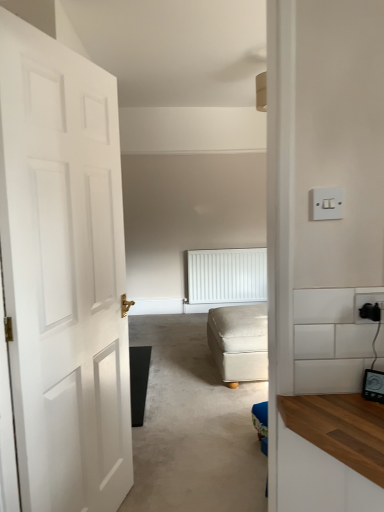
The image size is (384, 512). In order to click on white textured radiator at center in this screenshot , I will do `click(226, 276)`.

Describe the element at coordinates (239, 341) in the screenshot. The image size is (384, 512). I see `beige fabric ottoman at center` at that location.

Find the location of `white matte door at left`. white matte door at left is located at coordinates (193, 426).

I want to click on black plastic socket at right, so click(367, 307).

From a real-world perspective, which is physically above, white plastic light switch at upper right or black plastic socket at right?

From a 3D spatial view, white plastic light switch at upper right is above.

From the image's perspective, is white plastic light switch at upper right located beneath black plastic socket at right?

No, from the image's perspective, white plastic light switch at upper right is not below black plastic socket at right.

Between white matte door at left and beige fabric ottoman at center, which one is positioned behind?

Positioned behind is beige fabric ottoman at center.

The width and height of the screenshot is (384, 512). Find the location of `door that appears on the left of beige fabric ottoman at center`. door that appears on the left of beige fabric ottoman at center is located at coordinates (64, 273).

Does white matte door at left have a lesser height compared to beige fabric ottoman at center?

In fact, white matte door at left may be taller than beige fabric ottoman at center.

Measure the distance between white matte door at left and beige fabric ottoman at center.

They are 5.60 feet apart.

Based on their sizes in the image, would you say white matte door at left is bigger or smaller than white textured radiator at center?

white matte door at left is bigger than white textured radiator at center.

Who is more distant, white matte door at left or white textured radiator at center?

white textured radiator at center is more distant.

Is white matte door at left not near white textured radiator at center?

Yes, white matte door at left and white textured radiator at center are quite far apart.

Considering the relative sizes of white matte door at left and white textured radiator at center in the image provided, is white matte door at left taller than white textured radiator at center?

No, white matte door at left is not taller than white textured radiator at center.

Consider the image. Which is more to the left, white matte door at left or white plastic light switch at upper right?

white matte door at left.

From the image's perspective, is white matte door at left above or below white plastic light switch at upper right?

Based on their image positions, white matte door at left is located beneath white plastic light switch at upper right.

Does white matte door at left have a lesser width compared to white plastic light switch at upper right?

Incorrect, the width of white matte door at left is not less than that of white plastic light switch at upper right.

This screenshot has height=512, width=384. In order to click on plain on the left of beige fabric ottoman at center in this screenshot , I will do `click(193, 426)`.

Based on the photo, are beige fabric ottoman at center and white matte door at left making contact?

There is a gap between beige fabric ottoman at center and white matte door at left.

Is beige fabric ottoman at center in front of or behind white matte door at left in the image?

beige fabric ottoman at center is positioned farther from the viewer than white matte door at left.

Looking at this image, considering the relative positions of beige fabric ottoman at center and white matte door at left in the image provided, is beige fabric ottoman at center to the left of white matte door at left from the viewer's perspective?

Incorrect, beige fabric ottoman at center is not on the left side of white matte door at left.

Can you confirm if white textured radiator at center is taller than white matte door at left?

Yes.

Is white matte door at left a part of white textured radiator at center?

Definitely not — white matte door at left is not inside white textured radiator at center.

Where is `plain below the white textured radiator at center (from the image's perspective)`? This screenshot has height=512, width=384. plain below the white textured radiator at center (from the image's perspective) is located at coordinates (193, 426).

Considering the positions of objects white textured radiator at center and white matte door at left in the image provided, who is more to the right, white textured radiator at center or white matte door at left?

Positioned to the right is white textured radiator at center.

Is black plastic socket at right completely or partially outside of white plastic light switch at upper right?

Indeed, black plastic socket at right is completely outside white plastic light switch at upper right.

Considering the points (370, 316) and (333, 189), which point is in front, point (370, 316) or point (333, 189)?

The point (333, 189) is in front.

Locate an element on the screen. The height and width of the screenshot is (512, 384). electric outlet below the white plastic light switch at upper right (from the image's perspective) is located at coordinates (367, 307).

The height and width of the screenshot is (512, 384). Identify the location of light switch lying on the left of black plastic socket at right. (326, 203).

In order to click on studio couch that appears below the white matte door at left (from a real-world perspective) in this screenshot , I will do `click(239, 341)`.

Considering their positions, is beige fabric ottoman at center positioned closer to white matte door at left than white plastic light switch at upper right?

Among the two, white plastic light switch at upper right is located nearer to white matte door at left.

Based on their spatial positions, is white plastic light switch at upper right or black plastic socket at right further from beige fabric ottoman at center?

white plastic light switch at upper right is further to beige fabric ottoman at center.

Estimate the real-world distances between objects in this image. Which object is further from beige fabric ottoman at center, white plastic light switch at upper right or white matte door at left?

white plastic light switch at upper right is positioned further to the anchor beige fabric ottoman at center.

Estimate the real-world distances between objects in this image. Which object is closer to white matte door at left, white plastic light switch at upper right or white textured radiator at center?

Among the two, white plastic light switch at upper right is located nearer to white matte door at left.

Which object lies further to the anchor point white textured radiator at center, white matte door at left or white matte door at left?

white matte door at left is positioned further to the anchor white textured radiator at center.

From the image, which object appears to be farther from beige fabric ottoman at center, white matte door at left or black plastic socket at right?

black plastic socket at right.

Considering their positions, is white plastic light switch at upper right positioned further to white textured radiator at center than beige fabric ottoman at center?

Among the two, white plastic light switch at upper right is located further to white textured radiator at center.

Considering their positions, is white matte door at left positioned closer to white matte door at left than black plastic socket at right?

white matte door at left.

Find the location of a particular element. plain between white plastic light switch at upper right and white textured radiator at center along the z-axis is located at coordinates (193, 426).

Identify the location of studio couch located between white matte door at left and white textured radiator at center in the depth direction. The width and height of the screenshot is (384, 512). (239, 341).

Locate an element on the screen. This screenshot has width=384, height=512. plain positioned between white matte door at left and beige fabric ottoman at center from near to far is located at coordinates (193, 426).

Find the location of a particular element. This screenshot has width=384, height=512. door between white plastic light switch at upper right and white matte door at left vertically is located at coordinates (64, 273).